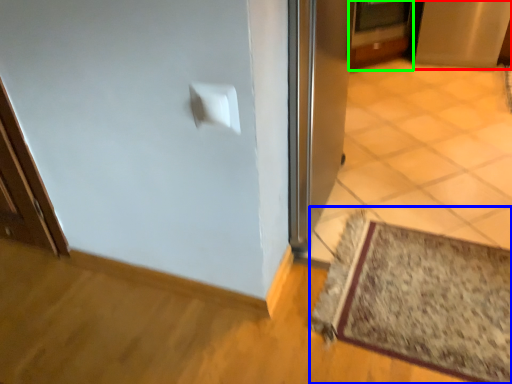
Question: Which object is positioned farthest from screen door (highlighted by a red box)? Select from mat (highlighted by a blue box) and door (highlighted by a green box).

Choices:
 (A) mat
 (B) door

Answer: (A)